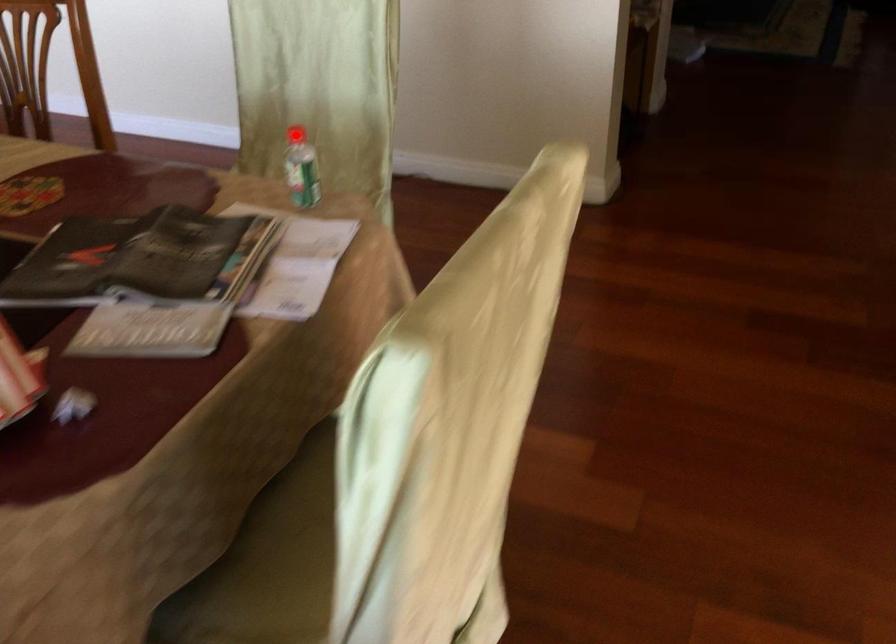
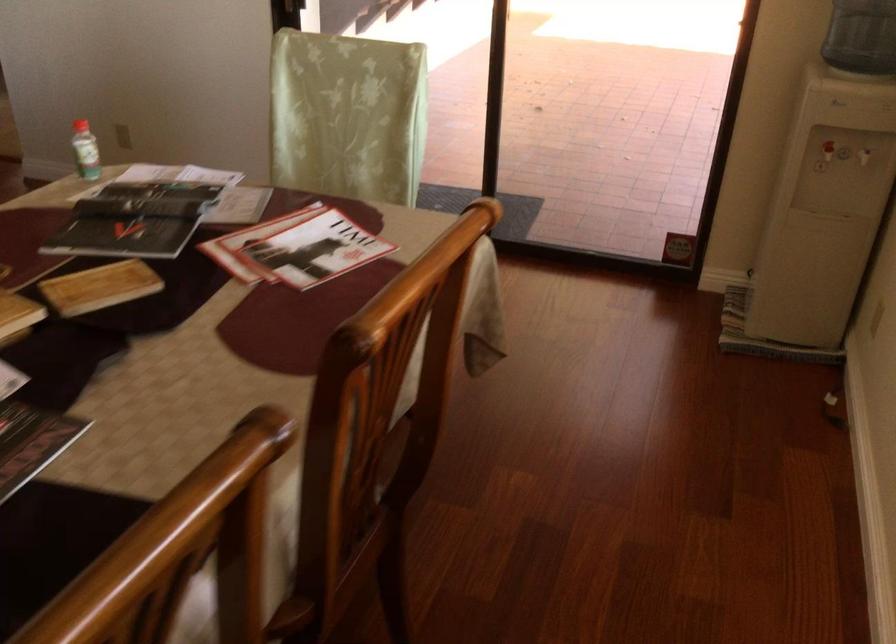
Question: I am providing you with two images of the same scene from different viewpoints. A red point is marked on the first image. At the location where the point appears in image 1, is it still visible in image 2?

Choices:
 (A) Yes
 (B) No

Answer: (B)